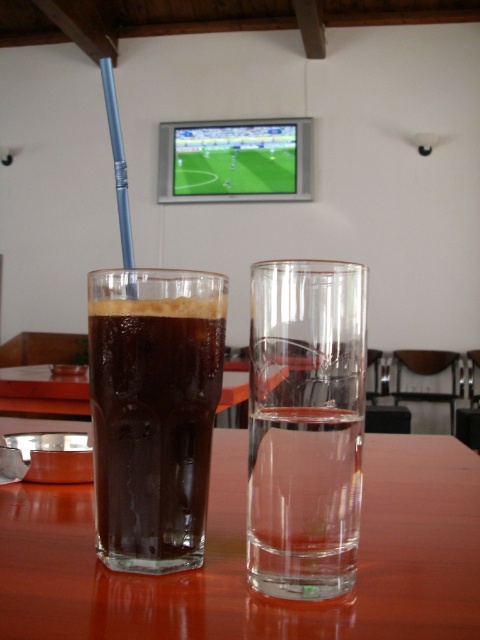
Question: Which object appears farthest from the camera in this image?

Choices:
 (A) transparent glass table at center
 (B) dark matte glass at left

Answer: (B)

Question: Can you confirm if transparent glass table at center is wider than dark matte glass at left?

Choices:
 (A) no
 (B) yes

Answer: (B)

Question: Is transparent glass table at center further to the viewer compared to dark matte glass at left?

Choices:
 (A) yes
 (B) no

Answer: (B)

Question: Is transparent glass table at center below dark matte glass at left?

Choices:
 (A) no
 (B) yes

Answer: (B)

Question: Which point appears closest to the camera in this image?

Choices:
 (A) (300, 605)
 (B) (139, 385)

Answer: (A)